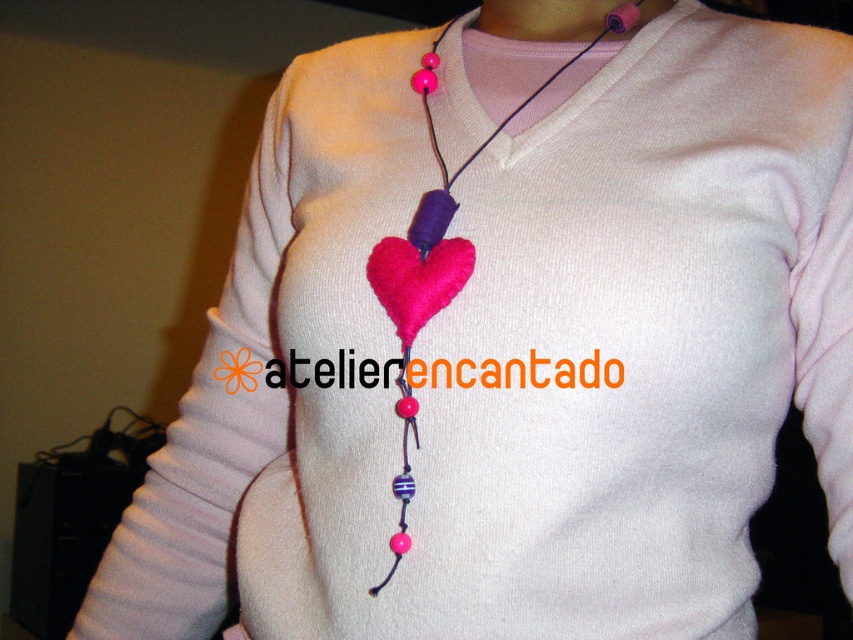
You are taking a photo of the necklace and need to focus on the closest point to the camera between point (450, 253) and point (633, 3). Which point should you focus on?

Point (450, 253) is closer to the camera than point (633, 3), so you should focus on point (450, 253).